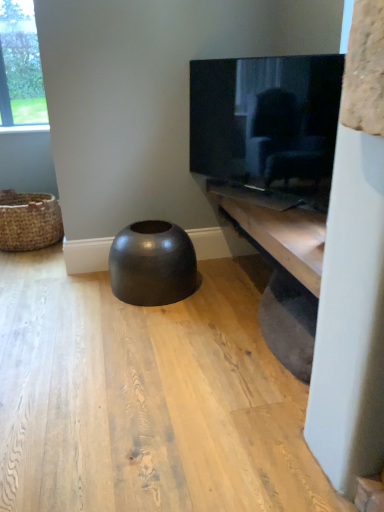
I want to click on vacant space in front of glossy black stool at center, so click(130, 331).